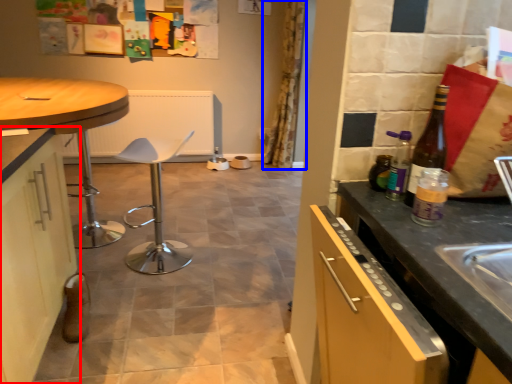
Question: Which object is further to the camera taking this photo, cabinetry (highlighted by a red box) or curtain (highlighted by a blue box)?

Choices:
 (A) cabinetry
 (B) curtain

Answer: (B)